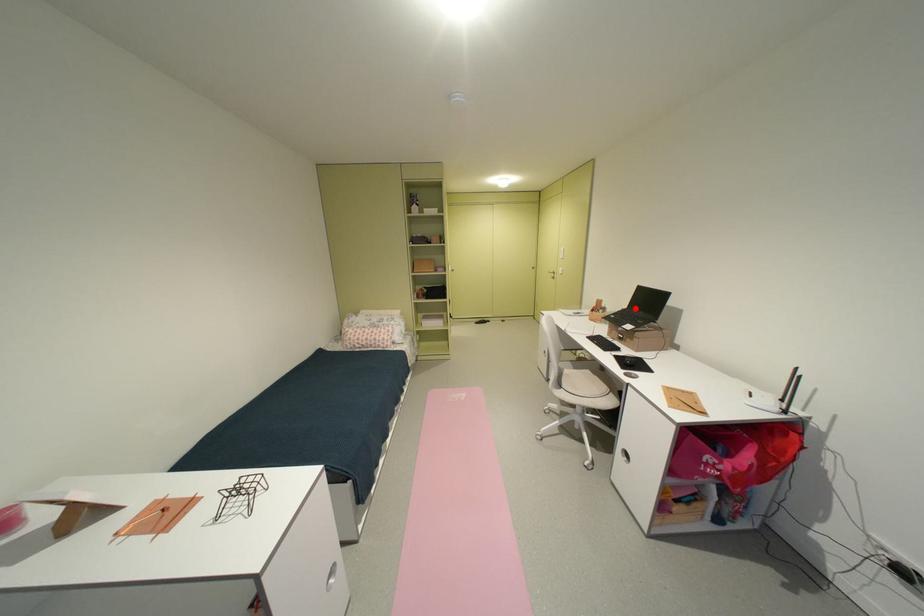
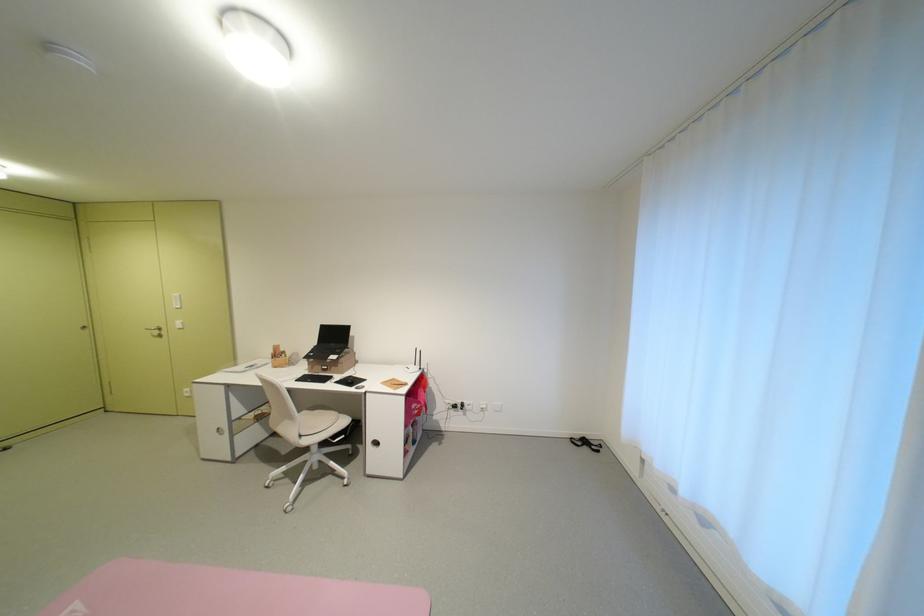
The point at the highlighted location is marked in the first image. Where is the corresponding point in the second image?

(324, 345)